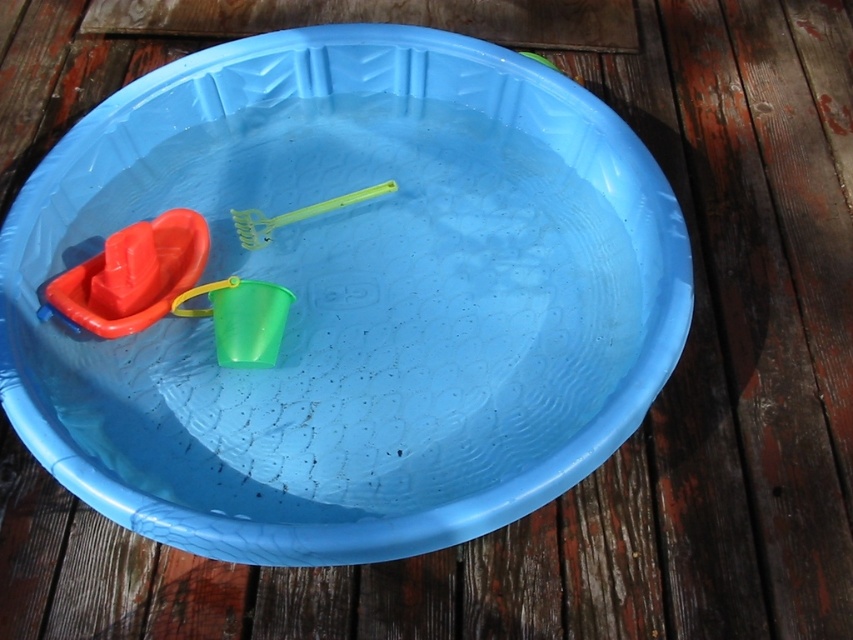
You are a child trying to reach both the matte plastic boat at left and the translucent green bucket at center from your current position on the wooden deck. Which object is closer to your right side?

The translucent green bucket at center is closer to your right side because the matte plastic boat at left is located to the left of it.

You are a child trying to pick up the matte plastic boat at left and the green plastic rake at center from the pool. Which object will require you to reach further into the pool?

The matte plastic boat at left requires reaching further into the pool since it is larger in size compared to the green plastic rake at center.

You are a child trying to reach the matte plastic boat at left and the green plastic rake at center in the pool. Which object is taller in the pool?

The matte plastic boat at left is much taller than the green plastic rake at center in the pool.